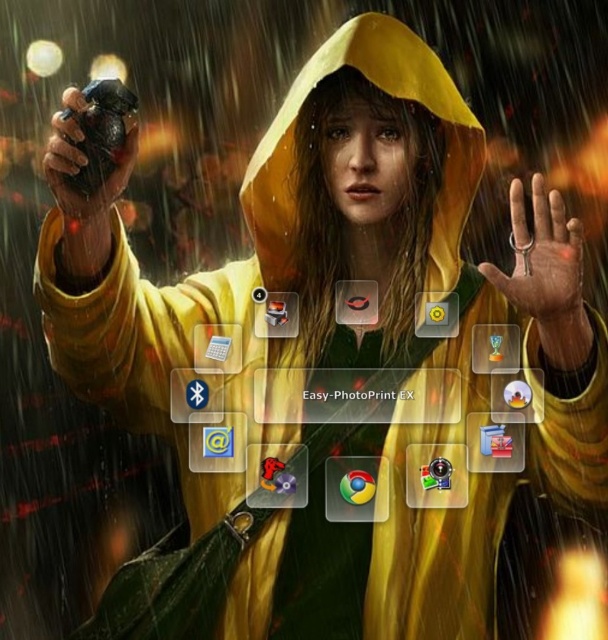
Is yellow matte hood at center to the left of rubberized black grip at left from the viewer's perspective?

In fact, yellow matte hood at center is to the right of rubberized black grip at left.

Is yellow matte hood at center closer to camera compared to rubberized black grip at left?

That is False.

At what (x,y) coordinates should I click in order to perform the action: click on yellow matte hood at center. Please return your answer as a coordinate pair (x, y). This screenshot has height=640, width=608. Looking at the image, I should click on (389, 93).

How distant is smooth metallic key at center from rubberized black grip at left?

A distance of 38.85 inches exists between smooth metallic key at center and rubberized black grip at left.

Between smooth metallic key at center and rubberized black grip at left, which one is positioned higher?

rubberized black grip at left is above.

Is point (541, 224) less distant than point (94, 150)?

No, (541, 224) is behind (94, 150).

Image resolution: width=608 pixels, height=640 pixels. What are the coordinates of `smooth metallic key at center` in the screenshot? It's located at (542, 259).

Measure the distance between yellow matte hood at center and smooth metallic key at center.

The distance of yellow matte hood at center from smooth metallic key at center is 11.72 inches.

Does yellow matte hood at center appear on the left side of smooth metallic key at center?

Yes, yellow matte hood at center is to the left of smooth metallic key at center.

Image resolution: width=608 pixels, height=640 pixels. In order to click on yellow matte hood at center in this screenshot , I will do `click(389, 93)`.